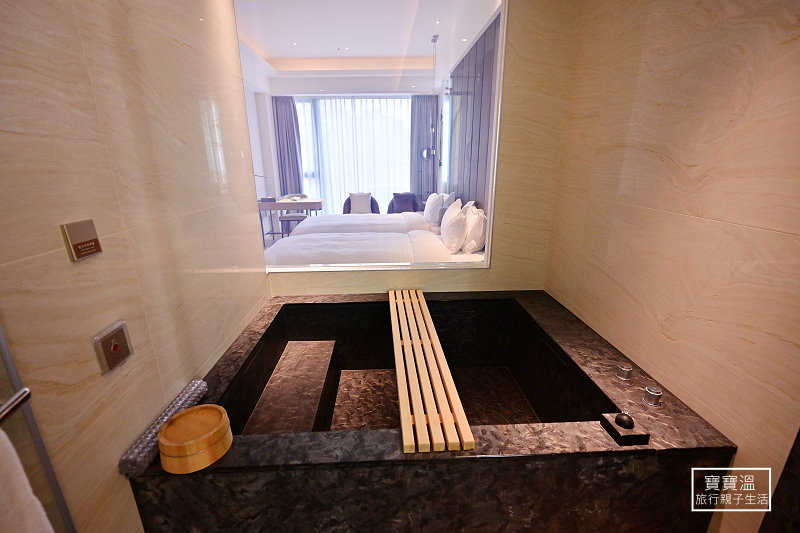
Image resolution: width=800 pixels, height=533 pixels. Find the location of `white pillows`. white pillows is located at coordinates (362, 197), (434, 209), (446, 198), (450, 225), (473, 219).